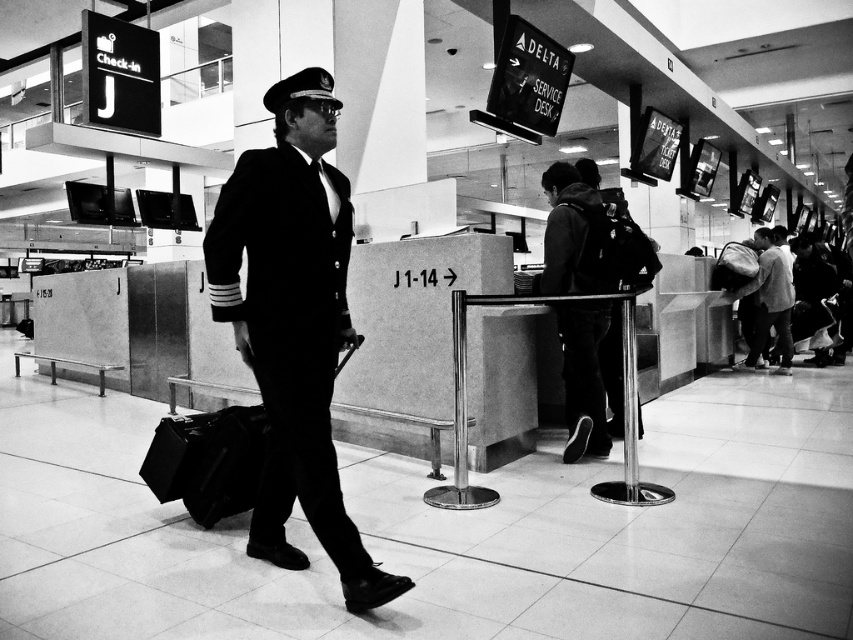
Question: Estimate the real-world distances between objects in this image. Which object is closer to the dark gray hoodie at center?

Choices:
 (A) velvet black uniform at center
 (B) matte black suitcase at center
 (C) light gray fabric backpack at center

Answer: (A)

Question: Is dark gray hoodie at center positioned behind matte black suitcase at center?

Choices:
 (A) yes
 (B) no

Answer: (A)

Question: In this image, where is velvet black uniform at center located relative to matte black suitcase at center?

Choices:
 (A) above
 (B) below

Answer: (A)

Question: Does velvet black uniform at center appear over light gray fabric backpack at center?

Choices:
 (A) no
 (B) yes

Answer: (A)

Question: Which object is positioned farthest from the light gray fabric backpack at center?

Choices:
 (A) matte black suitcase at center
 (B) dark gray hoodie at center

Answer: (A)

Question: Which of the following is the farthest from the observer?

Choices:
 (A) matte black suitcase at center
 (B) dark gray hoodie at center

Answer: (B)